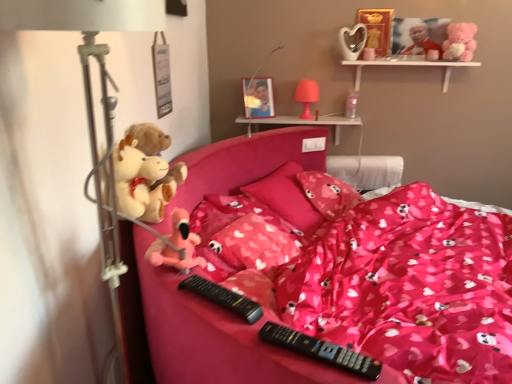
Question: Is white wooden shelf at upper right, the 2th shelf positioned from the left, thinner than pink fabric pillow at center, marked as the 2th pillow in a front-to-back arrangement?

Choices:
 (A) yes
 (B) no

Answer: (A)

Question: Is white wooden shelf at upper right, the first shelf in the top-to-bottom sequence, wider than pink fabric pillow at center, the second pillow when ordered from back to front?

Choices:
 (A) no
 (B) yes

Answer: (A)

Question: From the image's perspective, does white wooden shelf at upper right, the first shelf positioned from the right, appear lower than pink fabric pillow at center, the second pillow when ordered from back to front?

Choices:
 (A) no
 (B) yes

Answer: (A)

Question: Can you confirm if white wooden shelf at upper right, the first shelf in the top-to-bottom sequence, is shorter than pink fabric pillow at center, the second pillow when ordered from back to front?

Choices:
 (A) no
 (B) yes

Answer: (B)

Question: Does white wooden shelf at upper right, which appears as the second shelf when ordered from the bottom, come in front of pink fabric pillow at center, marked as the 2th pillow in a front-to-back arrangement?

Choices:
 (A) no
 (B) yes

Answer: (A)

Question: Considering the positions of point (317, 223) and point (166, 259), is point (317, 223) closer or farther from the camera than point (166, 259)?

Choices:
 (A) farther
 (B) closer

Answer: (A)

Question: Would you say pink fabric pillow at center, marked as the 2th pillow in a front-to-back arrangement, is to the left or to the right of pink plush toy at center, positioned as the 1th toy in front-to-back order, in the picture?

Choices:
 (A) left
 (B) right

Answer: (B)

Question: Choose the correct answer: Is pink fabric pillow at center, the second pillow when ordered from back to front, inside pink plush toy at center, the second toy in the left-to-right sequence, or outside it?

Choices:
 (A) outside
 (B) inside

Answer: (A)

Question: Looking at their shapes, would you say pink fabric pillow at center, the second pillow when ordered from back to front, is wider or thinner than pink plush toy at center, which is the fourth toy in right-to-left order?

Choices:
 (A) wide
 (B) thin

Answer: (A)

Question: From a real-world perspective, is white plastic table lamp at left, marked as the third table lamp in a right-to-left arrangement, positioned above or below pink plush bear at upper right, positioned as the fifth toy in left-to-right order?

Choices:
 (A) above
 (B) below

Answer: (B)

Question: Looking at the image, does white plastic table lamp at left, which is counted as the 1th table lamp, starting from the left, seem bigger or smaller compared to pink plush bear at upper right, the 4th toy ordered from the bottom?

Choices:
 (A) small
 (B) big

Answer: (B)

Question: In the image, is white plastic table lamp at left, marked as the third table lamp in a right-to-left arrangement, positioned in front of or behind pink plush bear at upper right, which appears as the 1th toy when viewed from the right?

Choices:
 (A) front
 (B) behind

Answer: (A)

Question: Is white plastic table lamp at left, placed as the 1th table lamp when sorted from front to back, wider or thinner than pink plush bear at upper right, the third toy positioned from the front?

Choices:
 (A) thin
 (B) wide

Answer: (B)

Question: Is point (137, 140) positioned closer to the camera than point (148, 251)?

Choices:
 (A) farther
 (B) closer

Answer: (A)

Question: Is fluffy plush toys at left, the fourth toy positioned from the back, bigger or smaller than pink plush toy at center, the second toy in the left-to-right sequence?

Choices:
 (A) big
 (B) small

Answer: (A)